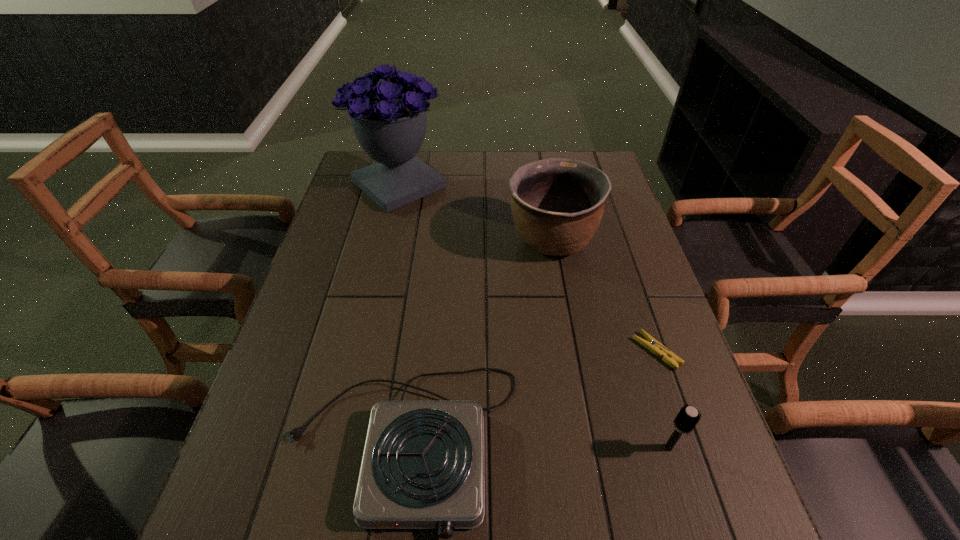
This screenshot has width=960, height=540. In order to click on vacant area between the shortest object and the tallest object in this screenshot , I will do `click(528, 268)`.

This screenshot has width=960, height=540. Find the location of `free space between the bouquet and the fourth shortest object`. free space between the bouquet and the fourth shortest object is located at coordinates (475, 213).

Locate an element on the screen. This screenshot has height=540, width=960. unoccupied area between the third tallest object and the pottery is located at coordinates (610, 344).

This screenshot has height=540, width=960. I want to click on blank region between the clothespin and the tallest object, so click(x=528, y=268).

Locate an element on the screen. unoccupied area between the hairbrush and the tallest object is located at coordinates (534, 316).

Locate an element on the screen. This screenshot has height=540, width=960. object that is the third closest to the hotplate is located at coordinates (557, 204).

What are the coordinates of `object that is the fourth closest to the hotplate` in the screenshot? It's located at (389, 121).

The width and height of the screenshot is (960, 540). I want to click on free space that satisfies the following two spatial constraints: 1. on the back side of the hairbrush; 2. on the left side of the shortest object, so click(638, 351).